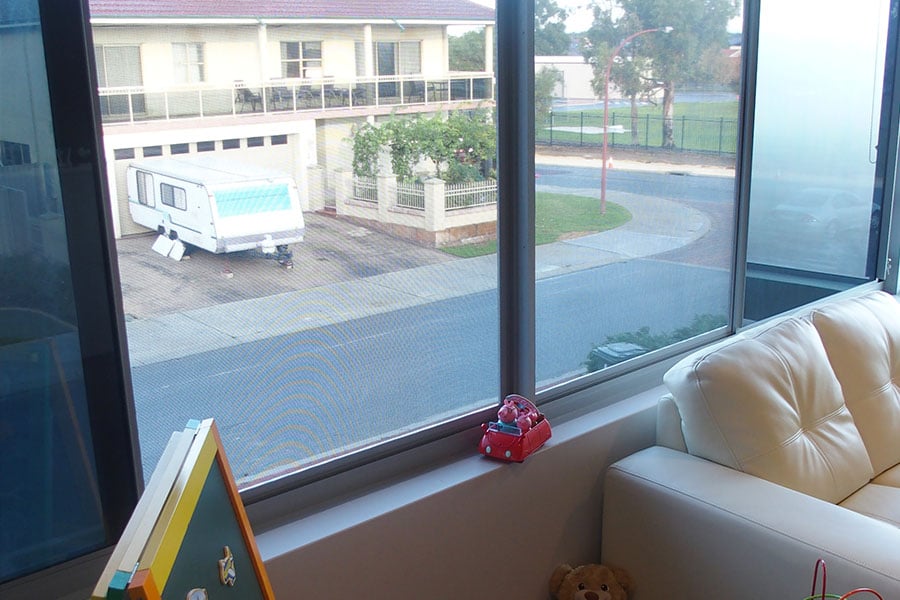
Locate an element on the screen. This screenshot has width=900, height=600. couch is located at coordinates (741, 468).